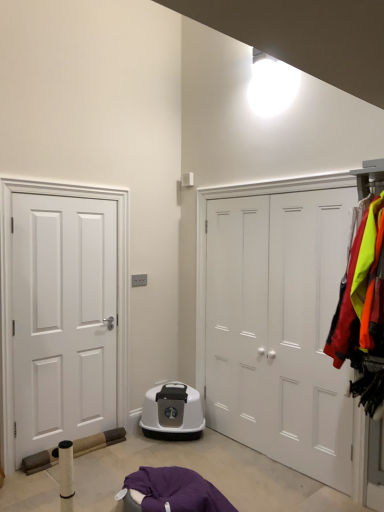
Measure the distance between white matte door at center, the 2th door from the left, and camera.

white matte door at center, the 2th door from the left, is 8.71 feet away from camera.

The height and width of the screenshot is (512, 384). Find the location of `reflective nylon jackets at right`. reflective nylon jackets at right is located at coordinates (362, 311).

Image resolution: width=384 pixels, height=512 pixels. What are the coordinates of `white matte door at left, positioned as the first door in left-to-right order` in the screenshot? It's located at (63, 319).

From the image's perspective, relative to white matte door at left, the 2th door in the right-to-left sequence, is reflective nylon jackets at right above or below?

From the image's perspective, reflective nylon jackets at right appears above white matte door at left, the 2th door in the right-to-left sequence.

From a real-world perspective, is reflective nylon jackets at right positioned above or below white matte door at left, the 2th door in the right-to-left sequence?

In terms of real-world spatial position, reflective nylon jackets at right is above white matte door at left, the 2th door in the right-to-left sequence.

How many degrees apart are the facing directions of reflective nylon jackets at right and white matte door at left, positioned as the first door in left-to-right order?

93 degrees separate the facing orientations of reflective nylon jackets at right and white matte door at left, positioned as the first door in left-to-right order.

Find the location of a particular element. the 2nd door counting from the left of the reflective nylon jackets at right is located at coordinates (63, 319).

Is white matte door at left, the 2th door in the right-to-left sequence, further to the viewer compared to reflective nylon jackets at right?

Yes.

Is white matte door at left, positioned as the first door in left-to-right order, located outside reflective nylon jackets at right?

Yes, white matte door at left, positioned as the first door in left-to-right order, is not within reflective nylon jackets at right.

Could you tell me if white matte door at left, the 2th door in the right-to-left sequence, is facing reflective nylon jackets at right?

Yes, white matte door at left, the 2th door in the right-to-left sequence, is facing reflective nylon jackets at right.

Can you confirm if white matte door at left, positioned as the first door in left-to-right order, is taller than reflective nylon jackets at right?

Correct, white matte door at left, positioned as the first door in left-to-right order, is much taller as reflective nylon jackets at right.

Is there a large distance between white matte door at center, the 1th door from the right, and white matte door at left, the 2th door in the right-to-left sequence?

Indeed, white matte door at center, the 1th door from the right, is not near white matte door at left, the 2th door in the right-to-left sequence.

Does white matte door at center, the 2th door from the left, lie behind white matte door at left, positioned as the first door in left-to-right order?

No, the depth of white matte door at center, the 2th door from the left, is less than that of white matte door at left, positioned as the first door in left-to-right order.

In the scene shown: Between white matte door at center, the 2th door from the left, and white matte door at left, the 2th door in the right-to-left sequence, which one appears on the right side from the viewer's perspective?

white matte door at center, the 2th door from the left.

Does white matte door at center, the 1th door from the right, turn towards white matte door at left, positioned as the first door in left-to-right order?

Yes.

Is white matte door at left, positioned as the first door in left-to-right order, positioned with its back to white matte door at center, the 1th door from the right?

No, white matte door at center, the 1th door from the right, is not at the back of white matte door at left, positioned as the first door in left-to-right order.

Considering the sizes of objects white matte door at left, positioned as the first door in left-to-right order, and white matte door at center, the 1th door from the right, in the image provided, who is taller, white matte door at left, positioned as the first door in left-to-right order, or white matte door at center, the 1th door from the right,?

Standing taller between the two is white matte door at center, the 1th door from the right.

From the image's perspective, between white matte door at left, the 2th door in the right-to-left sequence, and white matte door at center, the 2th door from the left, which one is located above?

white matte door at center, the 2th door from the left, from the image's perspective.

From a real-world perspective, is white matte door at left, the 2th door in the right-to-left sequence, positioned above or below white matte door at center, the 2th door from the left?

From a real-world perspective, white matte door at left, the 2th door in the right-to-left sequence, is physically below white matte door at center, the 2th door from the left.

Where is `laundry to the right of white matte door at center, the 2th door from the left`? Image resolution: width=384 pixels, height=512 pixels. laundry to the right of white matte door at center, the 2th door from the left is located at coordinates (362, 311).

From a real-world perspective, between reflective nylon jackets at right and white matte door at center, the 2th door from the left, who is vertically higher?

reflective nylon jackets at right.

Is the position of reflective nylon jackets at right more distant than that of white matte door at center, the 2th door from the left?

No, reflective nylon jackets at right is closer to the camera.

In terms of width, does reflective nylon jackets at right look wider or thinner when compared to white matte door at center, the 2th door from the left?

Clearly, reflective nylon jackets at right has more width compared to white matte door at center, the 2th door from the left.

You are a GUI agent. You are given a task and a screenshot of the screen. Output one action in this format:
    pyautogui.click(x=<x>, y=<y>)
    Task: Click on the laundry that appears in front of the white matte door at center, the 1th door from the right
    The height and width of the screenshot is (512, 384).
    Given the screenshot: What is the action you would take?
    pyautogui.click(x=362, y=311)

From the image's perspective, is white matte door at center, the 1th door from the right, on top of reflective nylon jackets at right?

No, from the image's perspective, white matte door at center, the 1th door from the right, is not on top of reflective nylon jackets at right.

From the picture: Is white matte door at center, the 1th door from the right, further to camera compared to reflective nylon jackets at right?

Yes, it is.

Considering the relative sizes of white matte door at center, the 1th door from the right, and reflective nylon jackets at right in the image provided, is white matte door at center, the 1th door from the right, bigger than reflective nylon jackets at right?

Actually, white matte door at center, the 1th door from the right, might be smaller than reflective nylon jackets at right.

Identify the location of the 2nd door counting from the left side of the reflective nylon jackets at right. (63, 319).

Identify the location of door that is the 2nd one below the reflective nylon jackets at right (from a real-world perspective). (63, 319).

Which object lies nearer to the anchor point white matte door at center, the 1th door from the right, reflective nylon jackets at right or white matte door at left, the 2th door in the right-to-left sequence?

reflective nylon jackets at right.

From the image, which object appears to be farther from white matte door at center, the 2th door from the left, white matte door at left, the 2th door in the right-to-left sequence, or reflective nylon jackets at right?

The object further to white matte door at center, the 2th door from the left, is white matte door at left, the 2th door in the right-to-left sequence.

Which object lies further to the anchor point white matte door at left, positioned as the first door in left-to-right order, white matte door at center, the 1th door from the right, or reflective nylon jackets at right?

The object further to white matte door at left, positioned as the first door in left-to-right order, is reflective nylon jackets at right.

Based on their spatial positions, is white matte door at left, positioned as the first door in left-to-right order, or white matte door at center, the 1th door from the right, closer to reflective nylon jackets at right?

white matte door at center, the 1th door from the right, is closer to reflective nylon jackets at right.

Considering their positions, is white matte door at center, the 2th door from the left, positioned closer to reflective nylon jackets at right than white matte door at left, the 2th door in the right-to-left sequence?

Based on the image, white matte door at center, the 2th door from the left, appears to be nearer to reflective nylon jackets at right.

Which object lies further to the anchor point white matte door at left, positioned as the first door in left-to-right order, reflective nylon jackets at right or white matte door at center, the 2th door from the left?

Among the two, reflective nylon jackets at right is located further to white matte door at left, positioned as the first door in left-to-right order.

Where is `door between white matte door at left, positioned as the first door in left-to-right order, and reflective nylon jackets at right`? This screenshot has height=512, width=384. door between white matte door at left, positioned as the first door in left-to-right order, and reflective nylon jackets at right is located at coordinates (279, 328).